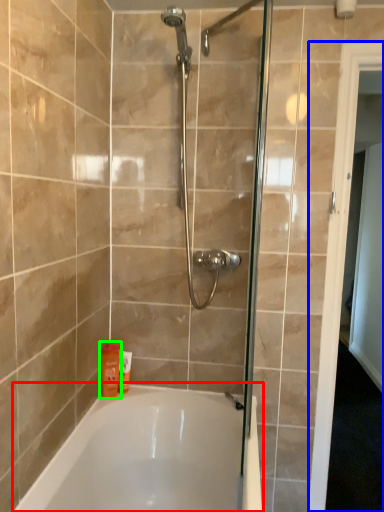
Question: Which object is positioned closest to bathtub (highlighted by a red box)? Select from screen door (highlighted by a blue box) and toiletry (highlighted by a green box).

Choices:
 (A) screen door
 (B) toiletry

Answer: (B)